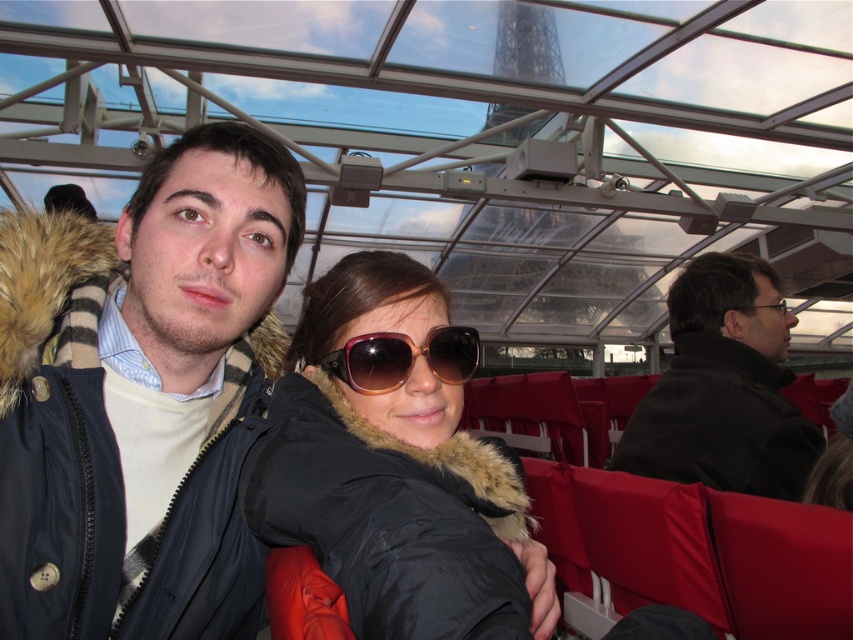
Question: Is dark brown leather jacket at right closer to the viewer compared to clear plastic glasses at center?

Choices:
 (A) yes
 (B) no

Answer: (A)

Question: Which point appears closest to the camera in this image?

Choices:
 (A) (775, 317)
 (B) (204, 292)

Answer: (B)

Question: Can you confirm if dark brown leather jacket at right is bigger than brown gradient plastic sunglasses at center?

Choices:
 (A) no
 (B) yes

Answer: (B)

Question: Is black fur-lined coat at center smaller than clear plastic glasses at center?

Choices:
 (A) yes
 (B) no

Answer: (B)

Question: Which object is the closest to the dark brown leather jacket at right?

Choices:
 (A) black fur-lined coat at center
 (B) dark blue jacket at center

Answer: (A)

Question: Which of the following is the closest to the observer?

Choices:
 (A) (782, 314)
 (B) (466, 358)

Answer: (B)